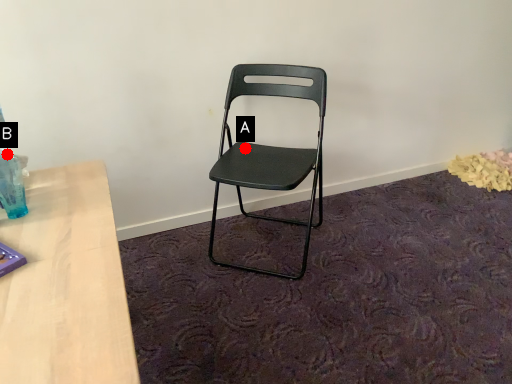
Question: Two points are circled on the image, labeled by A and B beside each circle. Which point is further to the camera?

Choices:
 (A) A is further
 (B) B is further

Answer: (A)